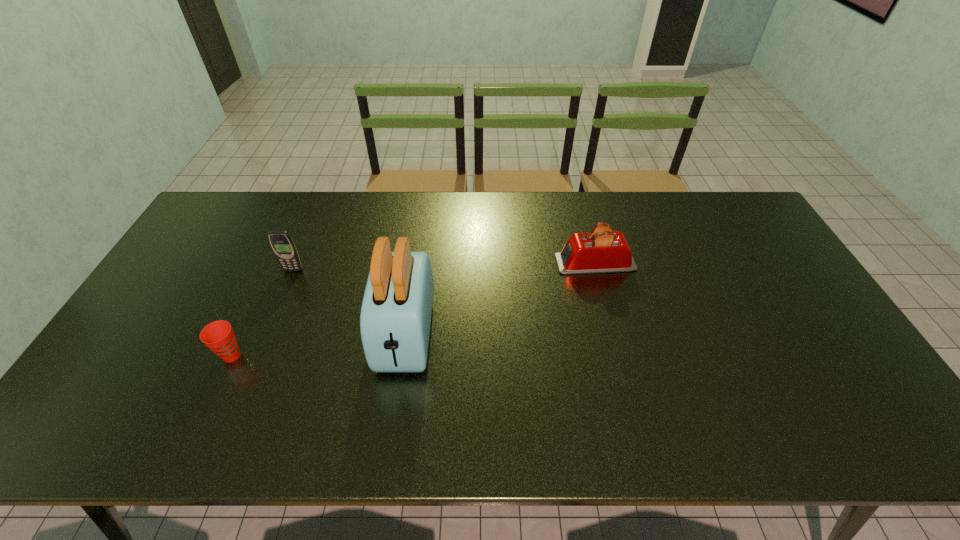
Find the location of a particular element. unoccupied position between the cellular telephone and the left toaster is located at coordinates (349, 302).

Locate which object ranks second in proximity to the nearer toaster. Please provide its 2D coordinates. Your answer should be formatted as a tuple, i.e. [(x, y)], where the tuple contains the x and y coordinates of a point satisfying the conditions above.

[(219, 336)]

The height and width of the screenshot is (540, 960). In order to click on object that is the third nearest to the cellular telephone in this screenshot , I will do `click(602, 250)`.